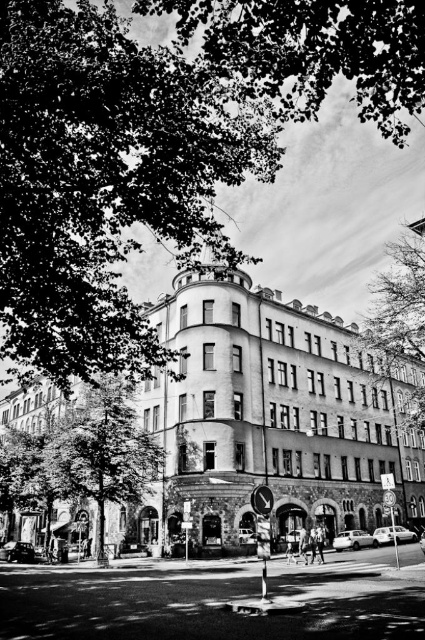
You are a window washer standing on the rooftop of the building. You need to clean the windows on the upper floors, but you notice two trees blocking your view. Which tree is closer to the rooftop? The green leafy tree at upper left or the dark green leafy tree at upper center?

The green leafy tree at upper left is closer to the rooftop because it is positioned below the dark green leafy tree at upper center, meaning the dark green tree is higher up and farther away from the rooftop.

You are a drone operator trying to capture a photo of the corner building. You notice a point at coordinates point (x=105, y=179) that might be blocking the view. What is located at that point?

The point (x=105, y=179) corresponds to a green leafy tree at upper left, which is partially obscuring the upper part of the building.

You are an urban planner assessing the view of the building. Which of the two green leafy trees, the green leafy tree at upper left or the green leafy tree at upper right, is closer to the building?

The green leafy tree at upper left is positioned over the green leafy tree at upper right, meaning it is closer to the building.